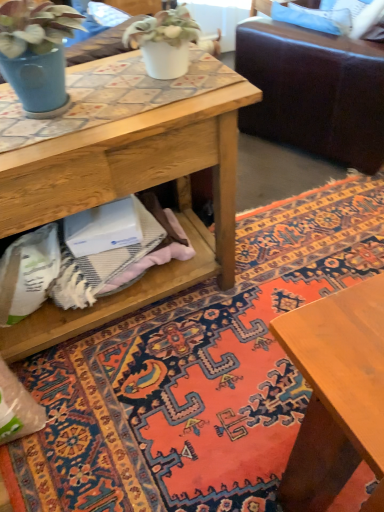
Describe the element at coordinates (195, 374) in the screenshot. I see `carpet with intricate patterns at center` at that location.

Where is `carpet with intricate patterns at center`? The height and width of the screenshot is (512, 384). carpet with intricate patterns at center is located at coordinates (195, 374).

Measure the distance between carpet with intricate patterns at center and camera.

They are 4.03 feet apart.

Identify the location of carpet with intricate patterns at center. The image size is (384, 512). (195, 374).